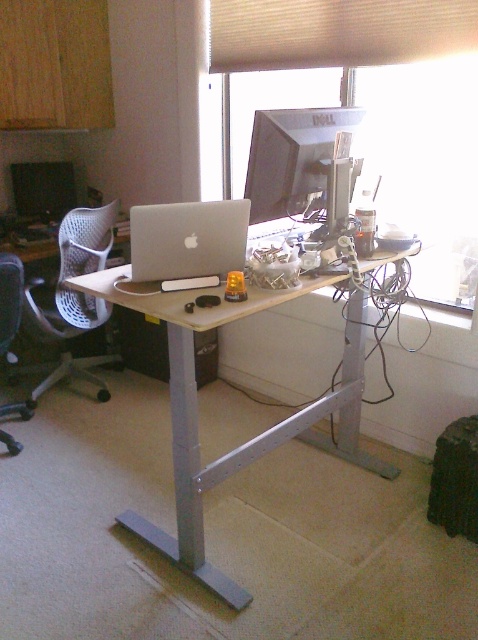
You are sitting in the black fabric office chair at left and want to reach the matte black monitor at upper center. Is the monitor within your immediate reach without moving your chair?

The matte black monitor at upper center is in front of the black fabric office chair at left, so it should be within immediate reach without needing to move the chair.

You are standing in front of the standing desk and want to reach the point at coordinates (464, 285). If your arm can extend 3 feet, can you reach it?

The point at coordinates (464, 285) is 8.59 feet away from you, which is farther than your arm can reach. You cannot reach it.

You are a delivery person who needs to place a package on the desk. The package is 0.5 meters wide. The desk is 1.2 meters wide. The point at the center of the desk is at coordinate point (336,33). Is the center of the desk on the window?

The point at the center of the desk is at coordinate point (336,33), which is on the transparent glass window at upper center. Therefore, the center of the desk is on the window.